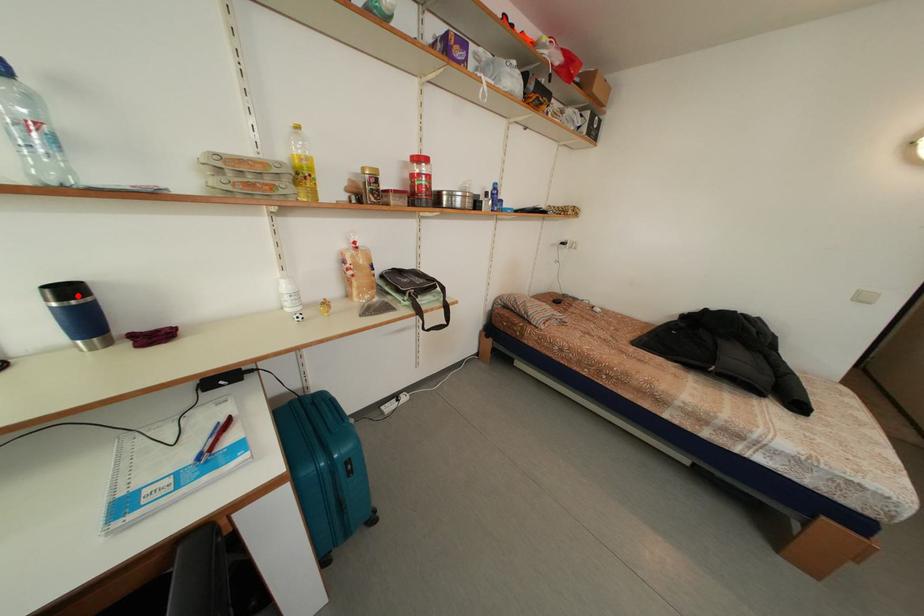
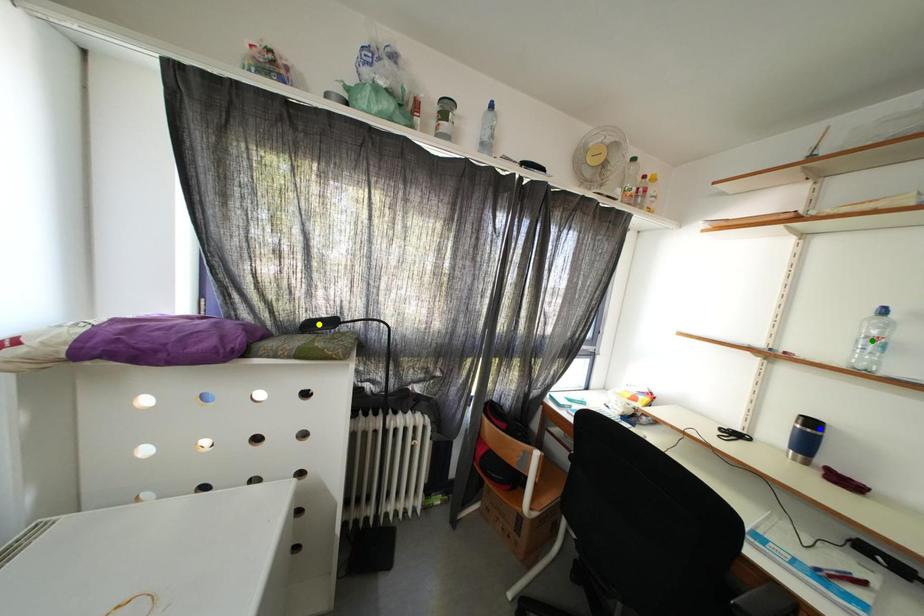
Question: I am providing you with two images of the same scene from different viewpoints. A red point is marked on the first image. You are given multiple points on the second image. Can you choose the point in image 2 that corresponds to the point in image 1?

Choices:
 (A) green point
 (B) blue point
 (C) yellow point

Answer: (B)